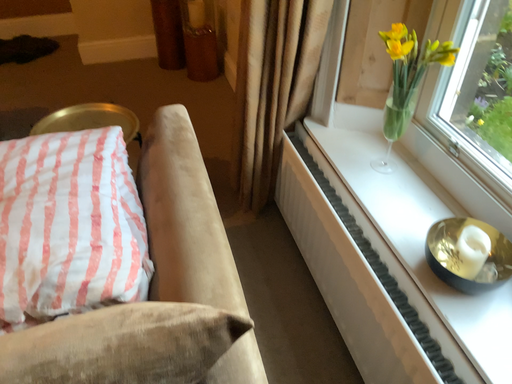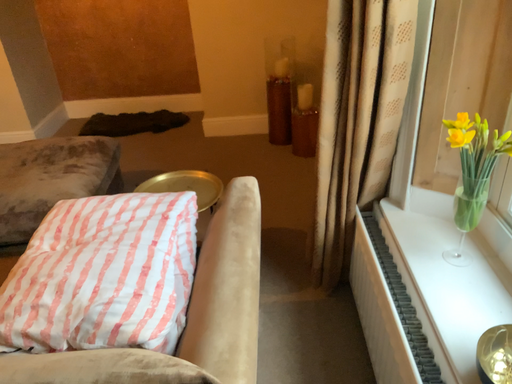
Question: How did the camera likely rotate when shooting the video?

Choices:
 (A) rotated right
 (B) rotated left

Answer: (B)